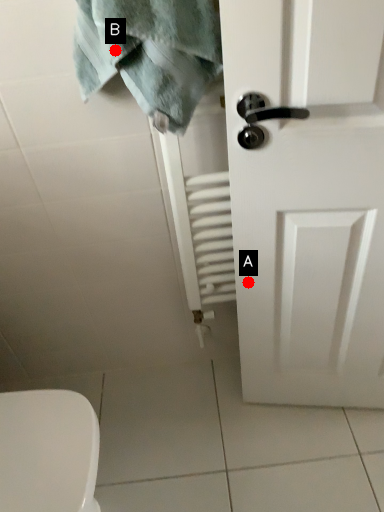
Question: Two points are circled on the image, labeled by A and B beside each circle. Which point appears closest to the camera in this image?

Choices:
 (A) A is closer
 (B) B is closer

Answer: (B)